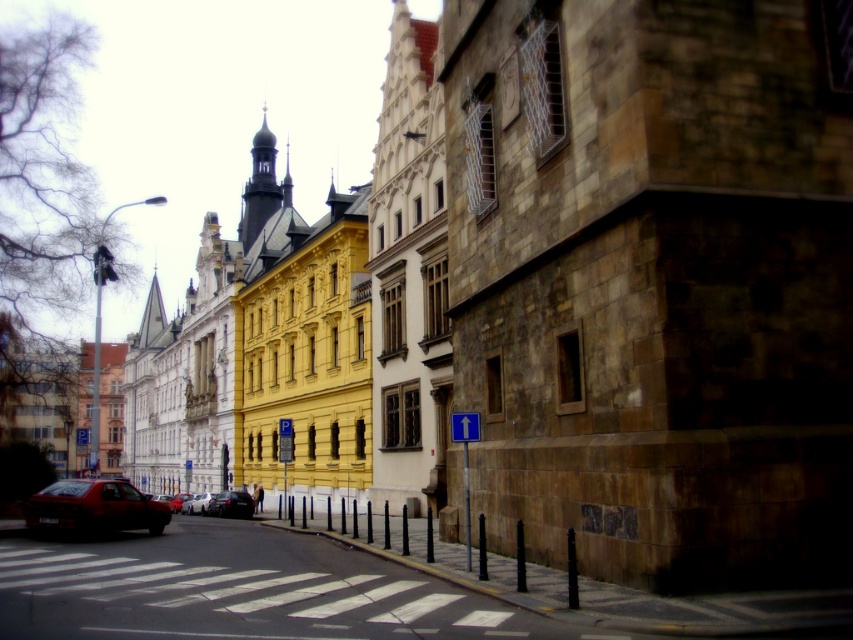
Does point (469, 417) lie behind point (200, 496)?

That is False.

Describe the element at coordinates (463, 426) in the screenshot. I see `blue plastic sign at upper center` at that location.

At what (x,y) coordinates should I click in order to perform the action: click on blue plastic sign at upper center. Please return your answer as a coordinate pair (x, y). This screenshot has width=853, height=640. Looking at the image, I should click on (463, 426).

I want to click on blue plastic sign at upper center, so click(463, 426).

Can you confirm if shiny red sedan at lower left is shorter than shiny black car at center?

Incorrect, shiny red sedan at lower left's height does not fall short of shiny black car at center's.

Is shiny red sedan at lower left closer to camera compared to shiny black car at center?

Yes, it is.

Is point (93, 480) behind point (213, 513)?

That is False.

The width and height of the screenshot is (853, 640). Find the location of `shiny red sedan at lower left`. shiny red sedan at lower left is located at coordinates (x=94, y=508).

Describe the element at coordinates (463, 426) in the screenshot. I see `blue plastic sign at upper center` at that location.

In order to click on blue plastic sign at upper center in this screenshot , I will do `click(463, 426)`.